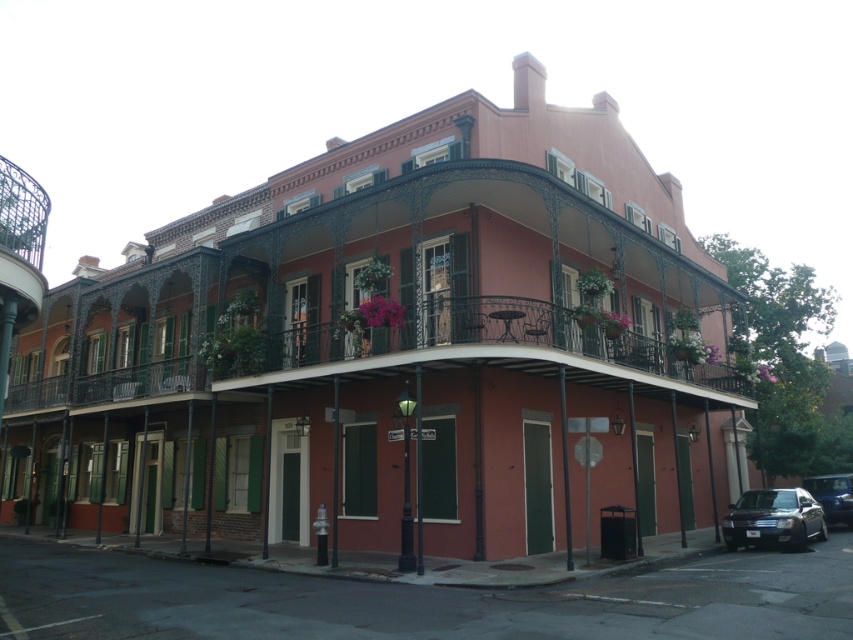
You are a delivery person needing to park a large delivery truck in front of the historic building. You see the shiny black sedan at lower right and the shiny blue sedan at lower right. Which car should you move to make space for the truck?

You should move the shiny blue sedan at lower right because it is underneath the shiny black sedan at lower right, so moving the lower one first would allow easier access to move the upper car afterward.

You are standing in front of the historic building and want to take a photo. There are two points marked on the building facade at coordinates point (724, 532) and point (814, 497). Which point is closer to your camera when you take the photo?

Point (724, 532) is closer to the camera than point (814, 497).